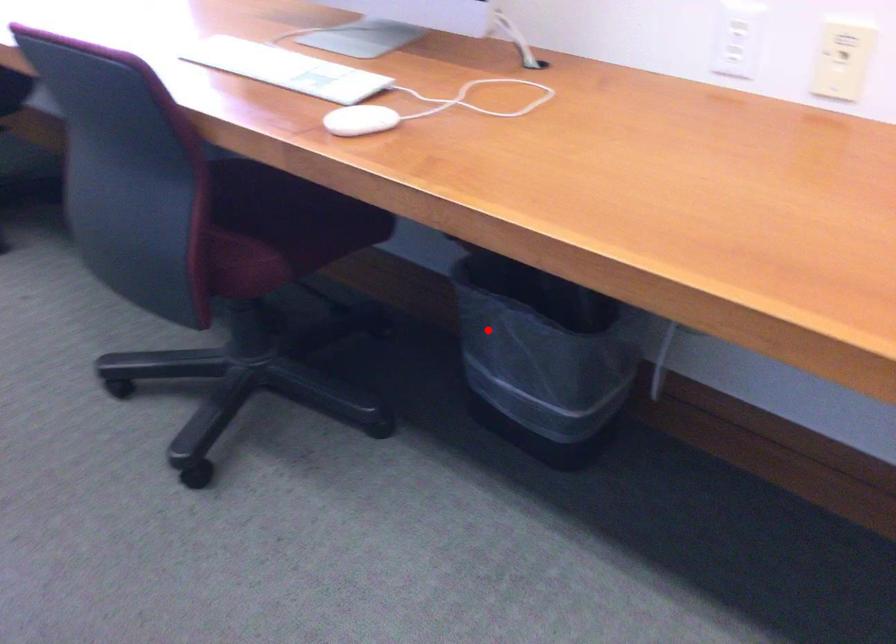
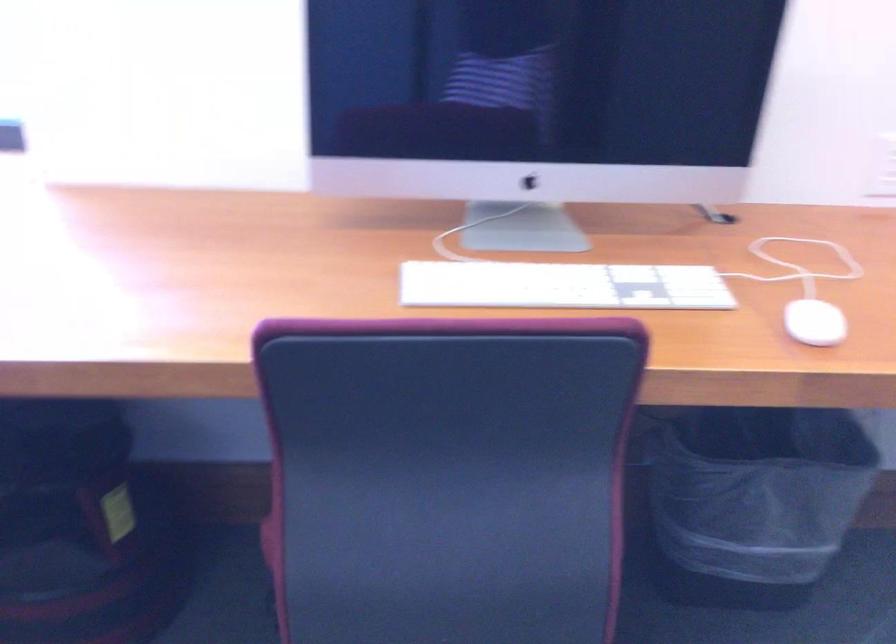
Question: A red point is marked in image1. In image2, is the corresponding 3D point closer to the camera or farther? Reply with the corresponding letter.

Choices:
 (A) The corresponding 3D point is closer.
 (B) The corresponding 3D point is farther.

Answer: (A)